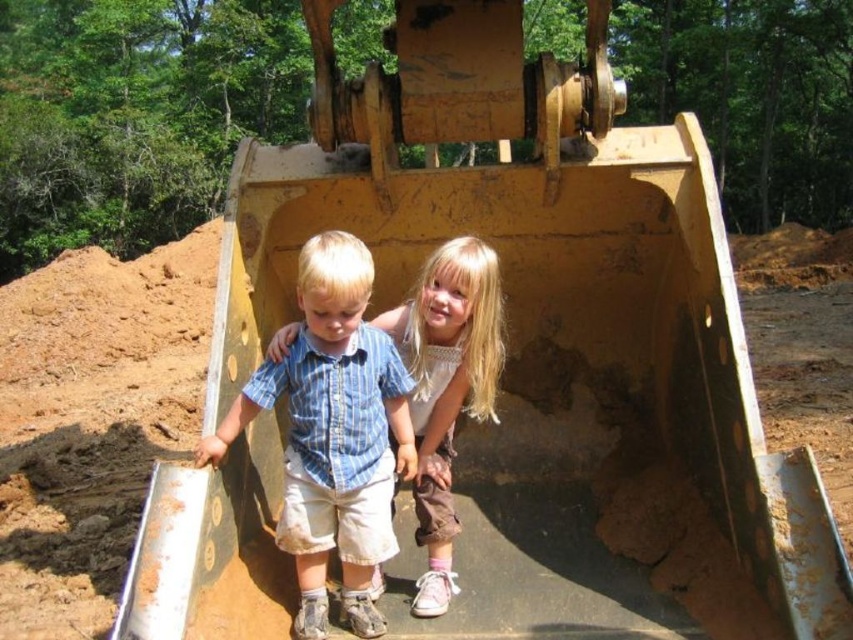
In the scene shown: You are a photographer trying to capture a photo of both the blue striped shirt at center and the smooth white shirt at center. Since you want to ensure both shirts are fully visible in the frame, which shirt should you position closer to the camera to avoid any overlap?

The blue striped shirt at center is taller than the smooth white shirt at center, so you should position the smooth white shirt at center closer to the camera to prevent the taller blue striped shirt at center from overlapping it.

You are a photographer trying to capture a clear photo of both the blue striped shirt at center and the smooth white shirt at center. Since you can only focus on one subject at a time, which shirt should you focus on to ensure the other is still in the background?

You should focus on the blue striped shirt at center because it is closer to the viewer than the smooth white shirt at center, so focusing on it will keep the background shirt in focus as well.